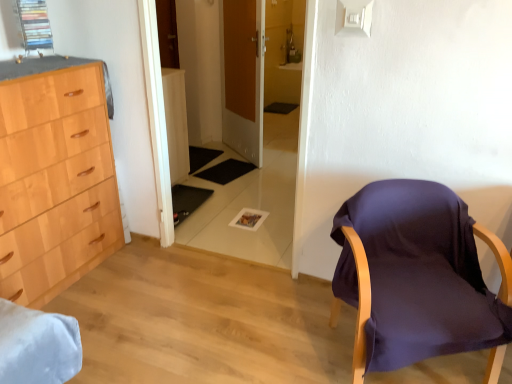
Question: Can we say transparent glass door at center lies outside purple fabric chair at right?

Choices:
 (A) yes
 (B) no

Answer: (A)

Question: From the image's perspective, is transparent glass door at center beneath purple fabric chair at right?

Choices:
 (A) yes
 (B) no

Answer: (B)

Question: Is transparent glass door at center in front of purple fabric chair at right?

Choices:
 (A) yes
 (B) no

Answer: (B)

Question: Is transparent glass door at center far from purple fabric chair at right?

Choices:
 (A) no
 (B) yes

Answer: (B)

Question: Does transparent glass door at center have a lesser width compared to purple fabric chair at right?

Choices:
 (A) no
 (B) yes

Answer: (B)

Question: From a real-world perspective, is transparent glass door at center over purple fabric chair at right?

Choices:
 (A) no
 (B) yes

Answer: (B)

Question: Is purple fabric chair at right facing towards transparent glass door at center?

Choices:
 (A) no
 (B) yes

Answer: (A)

Question: Is purple fabric chair at right positioned before transparent glass door at center?

Choices:
 (A) yes
 (B) no

Answer: (A)

Question: Is purple fabric chair at right outside of transparent glass door at center?

Choices:
 (A) no
 (B) yes

Answer: (B)

Question: Could transparent glass door at center be considered to be inside purple fabric chair at right?

Choices:
 (A) yes
 (B) no

Answer: (B)

Question: Is purple fabric chair at right oriented away from transparent glass door at center?

Choices:
 (A) no
 (B) yes

Answer: (A)

Question: Considering the relative sizes of purple fabric chair at right and transparent glass door at center in the image provided, is purple fabric chair at right bigger than transparent glass door at center?

Choices:
 (A) yes
 (B) no

Answer: (A)

Question: Considering the relative sizes of wooden door at center and transparent glass door at center in the image provided, is wooden door at center taller than transparent glass door at center?

Choices:
 (A) no
 (B) yes

Answer: (A)